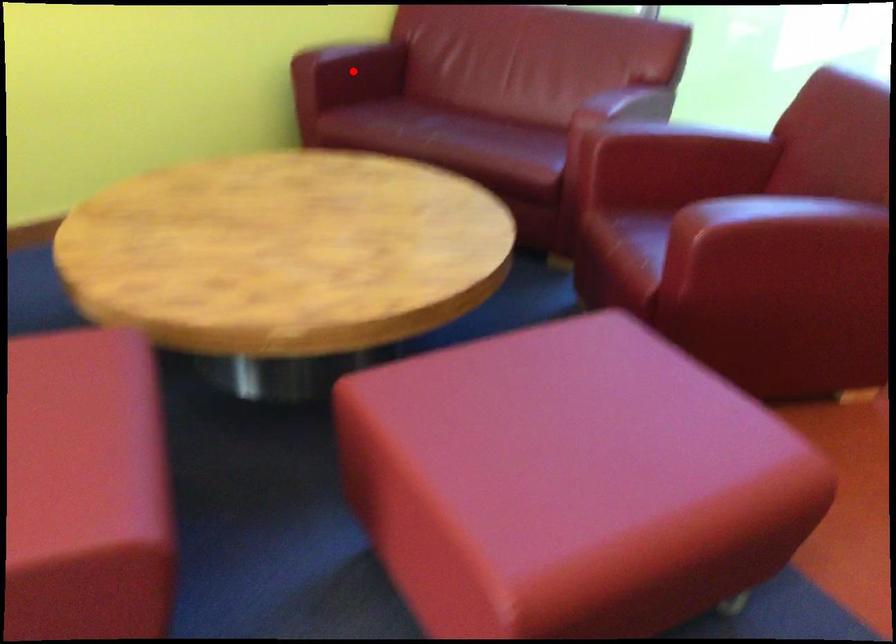
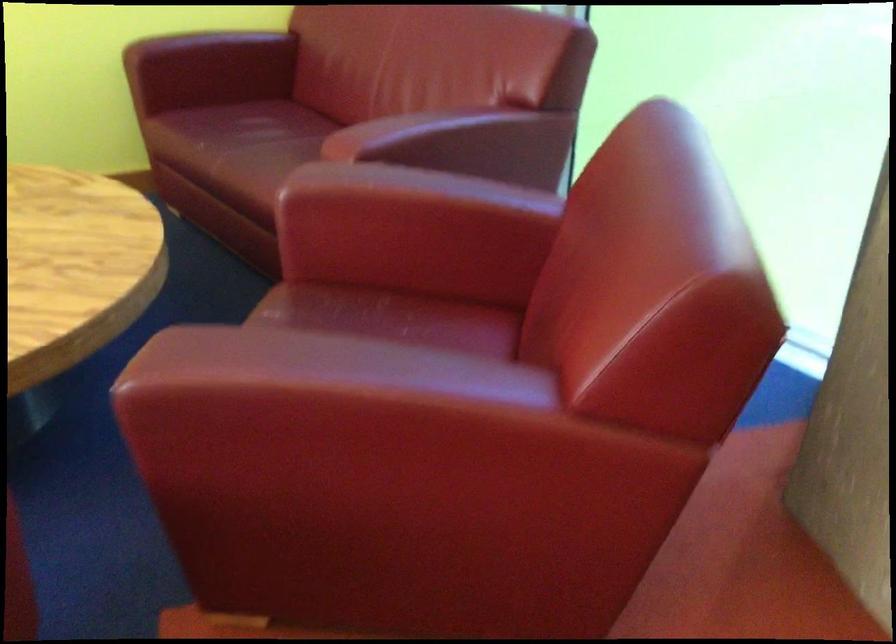
Question: A red point is marked in image1. In image2, is the corresponding 3D point closer to the camera or farther? Reply with the corresponding letter.

Choices:
 (A) The corresponding 3D point is closer.
 (B) The corresponding 3D point is farther.

Answer: (A)